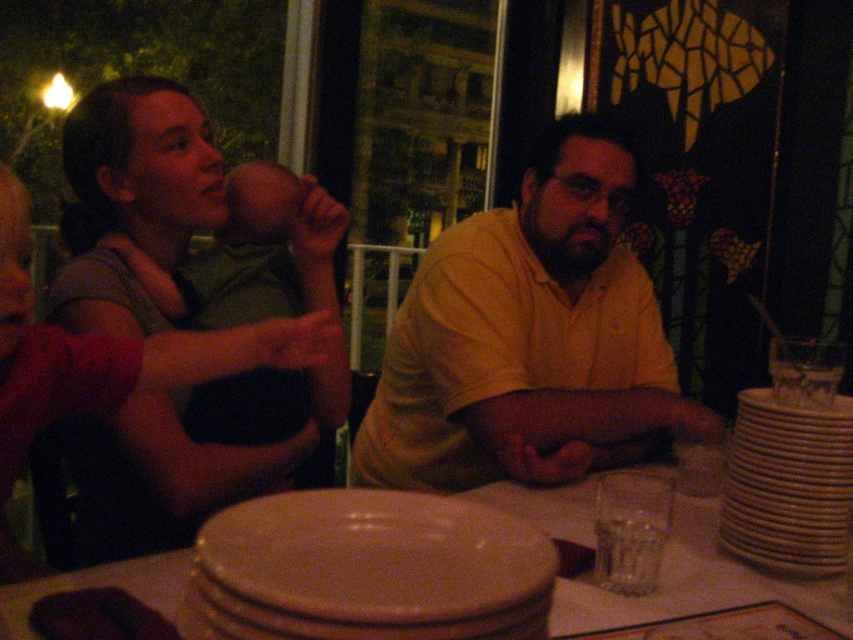
You are a waiter in a restaurant and need to place a new order on the table. The order includes a tall soup bowl. Which object on the table, the matte ceramic plate at center or the white ceramic stack at right, would be more suitable to place the soup bowl on to ensure stability?

The white ceramic stack at right is taller than the matte ceramic plate at center, so placing the tall soup bowl on the white ceramic stack at right would provide better stability due to its greater height.